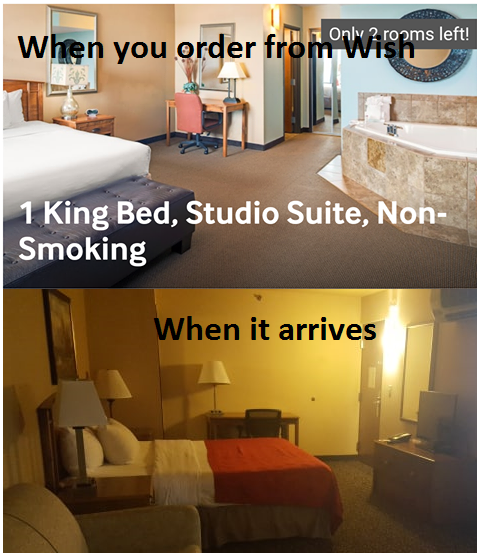
Find the location of a particular element. Image resolution: width=477 pixels, height=553 pixels. armchair is located at coordinates (24, 517).